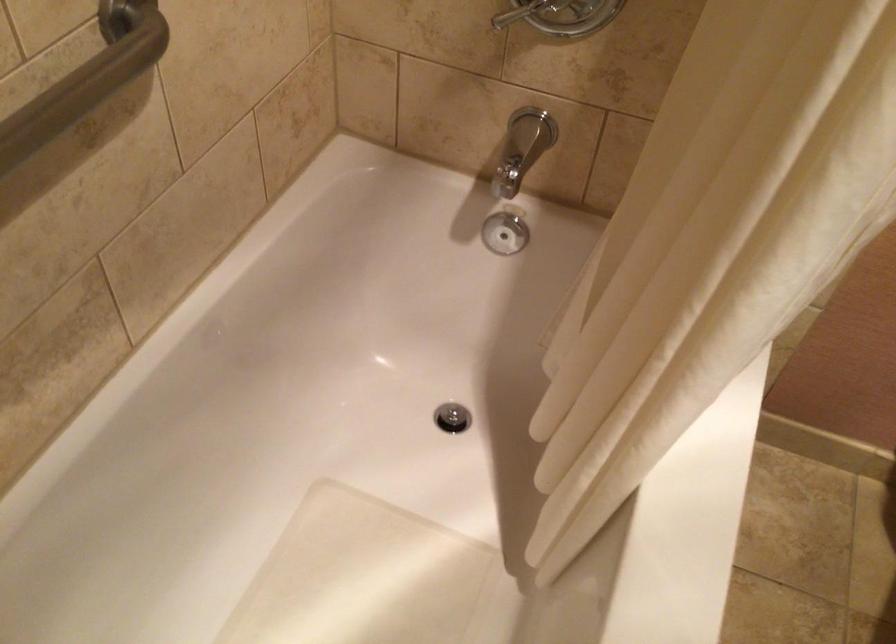
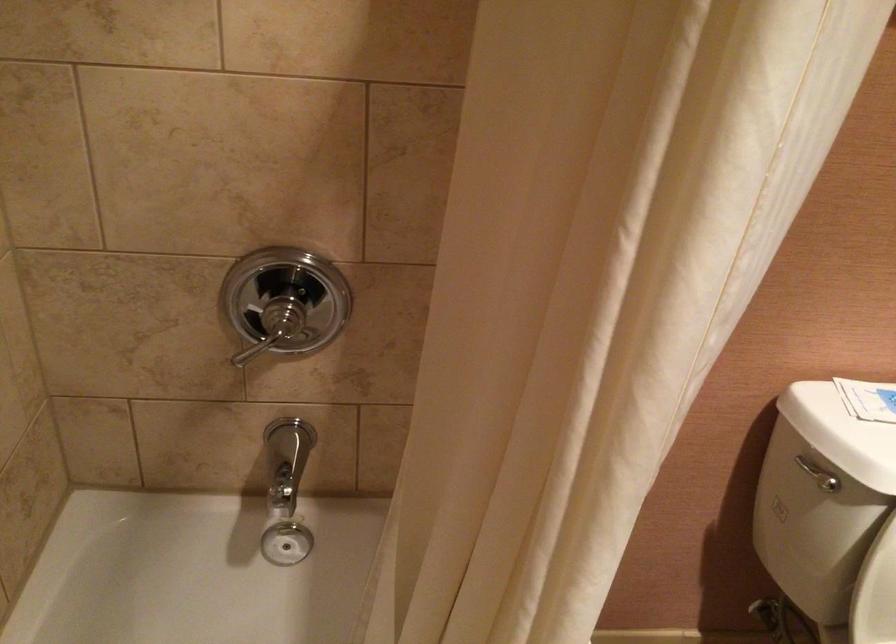
Question: The first image is from the beginning of the video and the second image is from the end. How did the camera likely rotate when shooting the video?

Choices:
 (A) Left
 (B) Right
 (C) Up
 (D) Down

Answer: (B)